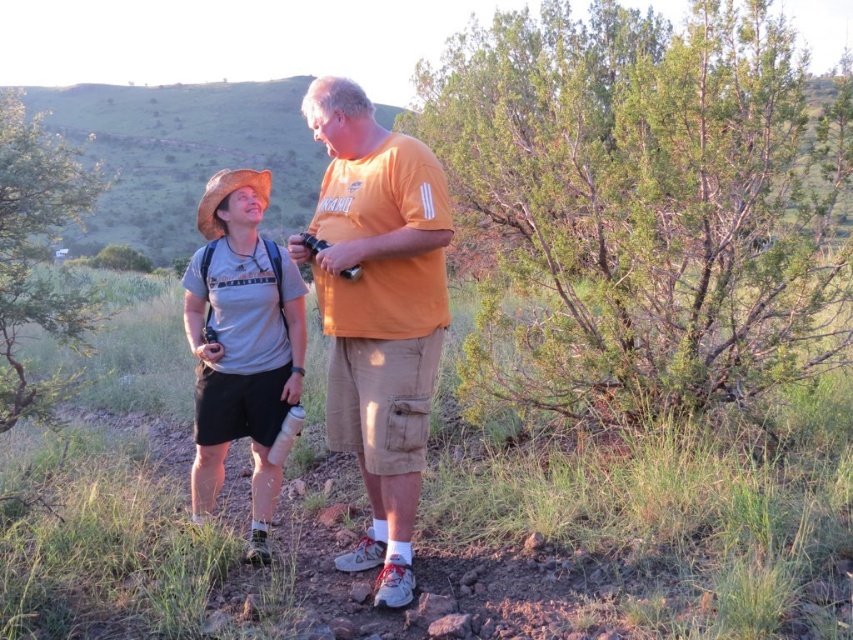
Question: Which of the following is the farthest from the observer?

Choices:
 (A) matte gray t-shirt at center
 (B) orange cotton t-shirt at center

Answer: (A)

Question: From the image, what is the correct spatial relationship of orange cotton t-shirt at center in relation to matte gray t-shirt at center?

Choices:
 (A) below
 (B) above

Answer: (B)

Question: Can you confirm if orange cotton t-shirt at center is smaller than matte gray t-shirt at center?

Choices:
 (A) no
 (B) yes

Answer: (A)

Question: Does orange cotton t-shirt at center have a lesser width compared to matte gray t-shirt at center?

Choices:
 (A) yes
 (B) no

Answer: (B)